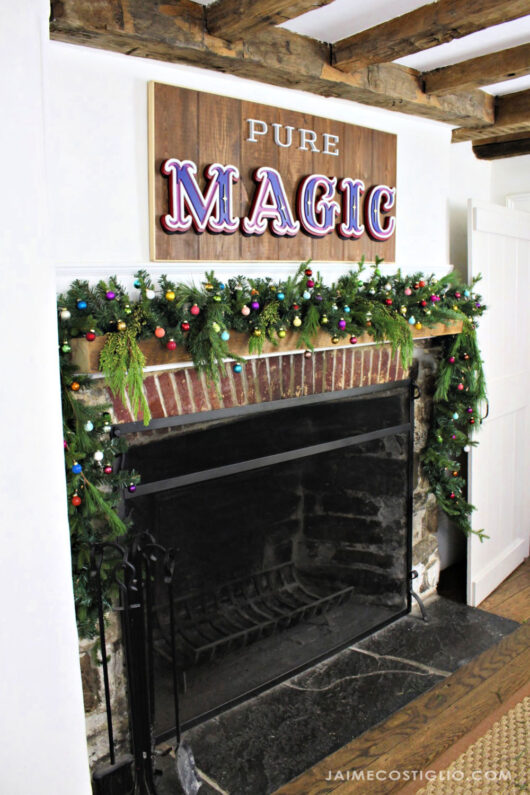
In order to click on this is where you put the fireplace logs in this screenshot , I will do `click(225, 626)`, `click(284, 596)`.